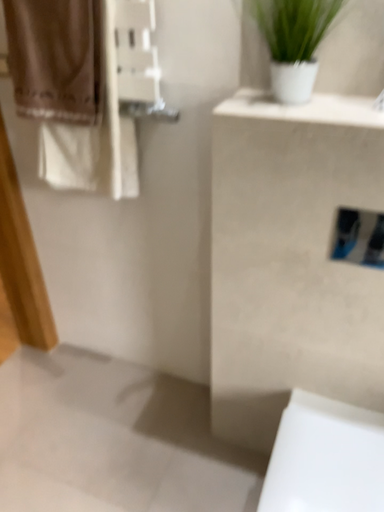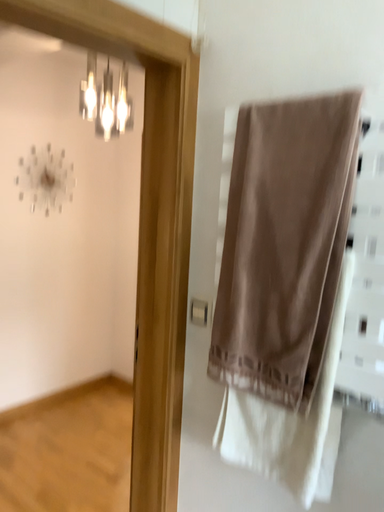
Question: How did the camera likely rotate when shooting the video?

Choices:
 (A) rotated downward
 (B) rotated upward

Answer: (B)